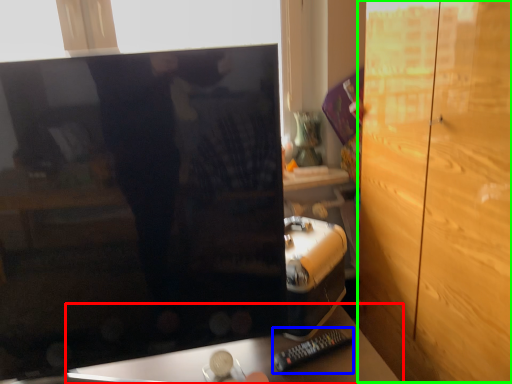
Question: Which is farther away from furniture (highlighted by a red box)? remote (highlighted by a blue box) or dresser (highlighted by a green box)?

Choices:
 (A) remote
 (B) dresser

Answer: (B)